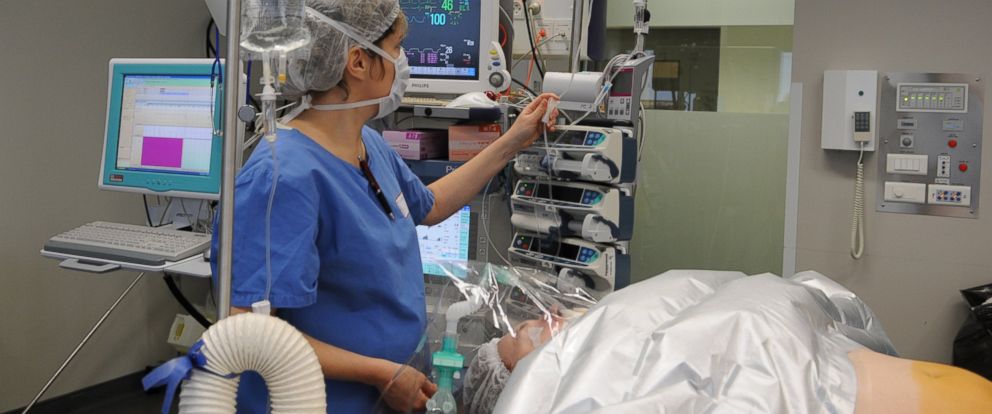
The image size is (992, 414). Find the location of `keyboard tray`. keyboard tray is located at coordinates (99, 264).